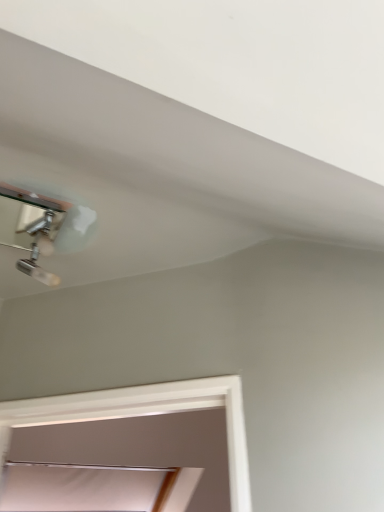
Question: Is white matte window at lower center a part of chrome metallic lamp at upper left?

Choices:
 (A) no
 (B) yes

Answer: (A)

Question: Can you confirm if chrome metallic lamp at upper left is taller than white matte window at lower center?

Choices:
 (A) no
 (B) yes

Answer: (A)

Question: Considering the relative sizes of chrome metallic lamp at upper left and white matte window at lower center in the image provided, is chrome metallic lamp at upper left smaller than white matte window at lower center?

Choices:
 (A) yes
 (B) no

Answer: (A)

Question: Could you tell me if chrome metallic lamp at upper left is facing white matte window at lower center?

Choices:
 (A) no
 (B) yes

Answer: (A)

Question: Does chrome metallic lamp at upper left have a lesser height compared to white matte window at lower center?

Choices:
 (A) yes
 (B) no

Answer: (A)

Question: Is white matte window at lower center at the back of chrome metallic lamp at upper left?

Choices:
 (A) yes
 (B) no

Answer: (B)

Question: Is there a large distance between white matte window at lower center and chrome metallic lamp at upper left?

Choices:
 (A) no
 (B) yes

Answer: (B)

Question: Are white matte window at lower center and chrome metallic lamp at upper left making contact?

Choices:
 (A) yes
 (B) no

Answer: (B)

Question: Is white matte window at lower center smaller than chrome metallic lamp at upper left?

Choices:
 (A) no
 (B) yes

Answer: (A)

Question: From the image's perspective, does white matte window at lower center appear higher than chrome metallic lamp at upper left?

Choices:
 (A) yes
 (B) no

Answer: (B)

Question: Is the depth of white matte window at lower center less than that of chrome metallic lamp at upper left?

Choices:
 (A) yes
 (B) no

Answer: (B)

Question: Does white matte window at lower center have a lesser height compared to chrome metallic lamp at upper left?

Choices:
 (A) yes
 (B) no

Answer: (B)

Question: From a real-world perspective, is chrome metallic lamp at upper left above or below white matte window at lower center?

Choices:
 (A) below
 (B) above

Answer: (B)